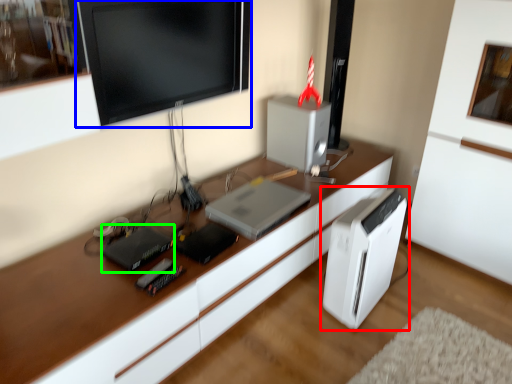
Question: Which is nearer to the home appliance (highlighted by a red box)? computer monitor (highlighted by a blue box) or appliance (highlighted by a green box).

Choices:
 (A) computer monitor
 (B) appliance

Answer: (B)